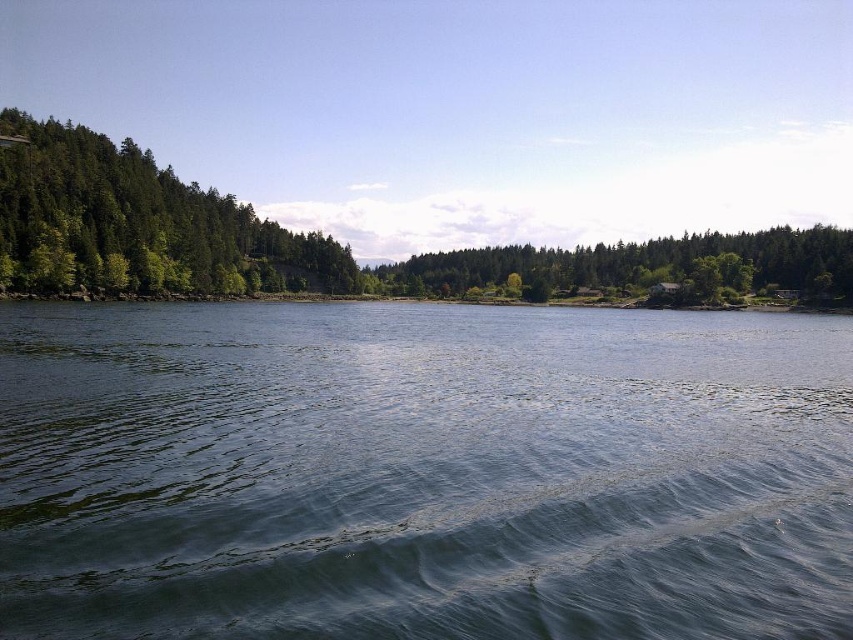
Question: Which of the following is the farthest from the observer?

Choices:
 (A) (119, 212)
 (B) (51, 157)
 (C) (689, 260)
 (D) (3, 548)

Answer: (C)

Question: Is clear water at center to the right of green matte forest at center from the viewer's perspective?

Choices:
 (A) no
 (B) yes

Answer: (B)

Question: Is clear water at center bigger than green matte tree at center?

Choices:
 (A) yes
 (B) no

Answer: (B)

Question: Estimate the real-world distances between objects in this image. Which object is farther from the green matte tree at center?

Choices:
 (A) green matte forest at center
 (B) green matte trees at left

Answer: (B)

Question: Estimate the real-world distances between objects in this image. Which object is closer to the clear water at center?

Choices:
 (A) green matte tree at center
 (B) green matte trees at left
 (C) green matte forest at center

Answer: (B)

Question: Considering the relative positions of clear water at center and green matte trees at left in the image provided, where is clear water at center located with respect to green matte trees at left?

Choices:
 (A) above
 (B) below

Answer: (B)